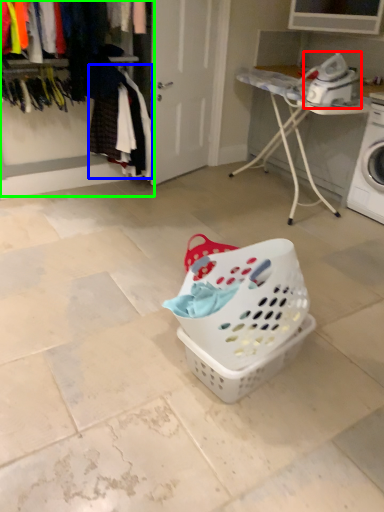
Question: Which object is the closest to the appliance (highlighted by a red box)? Choose among these: clothing (highlighted by a blue box) or closet (highlighted by a green box).

Choices:
 (A) clothing
 (B) closet

Answer: (A)